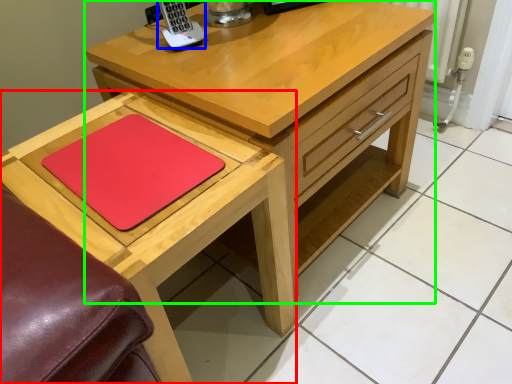
Question: Estimate the real-world distances between objects in this image. Which object is farther from table (highlighted by a red box), appliance (highlighted by a blue box) or chest of drawers (highlighted by a green box)?

Choices:
 (A) appliance
 (B) chest of drawers

Answer: (A)